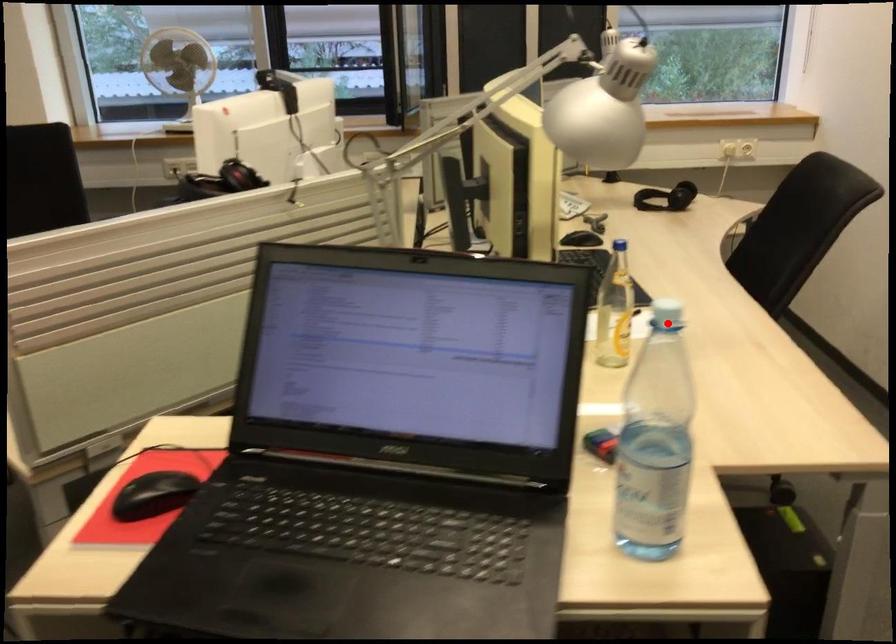
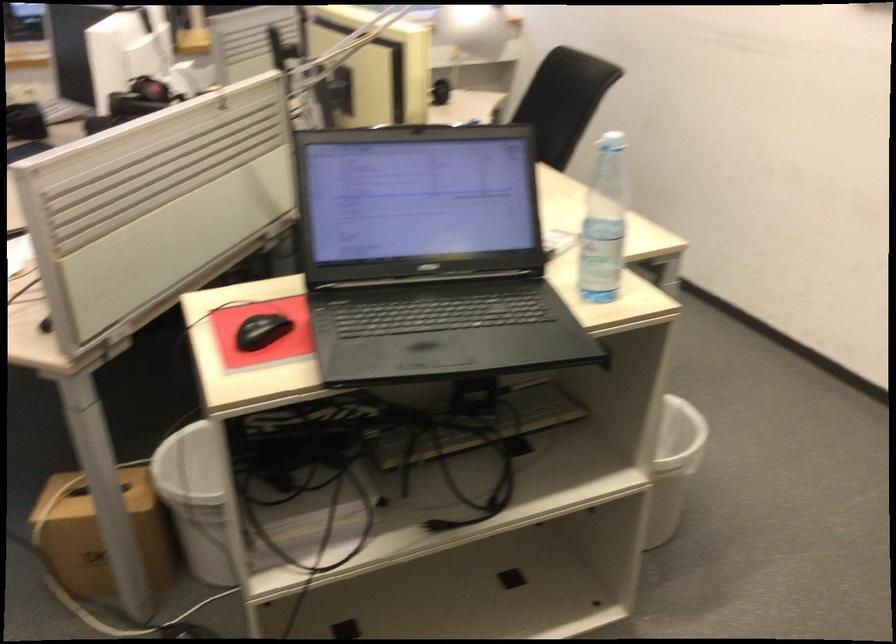
Question: I am providing you with two images of the same scene from different viewpoints. Image1 has a red point marked. In image2, the corresponding 3D location appears at what relative position? Reply with the corresponding letter.

Choices:
 (A) Closer
 (B) Farther

Answer: (B)